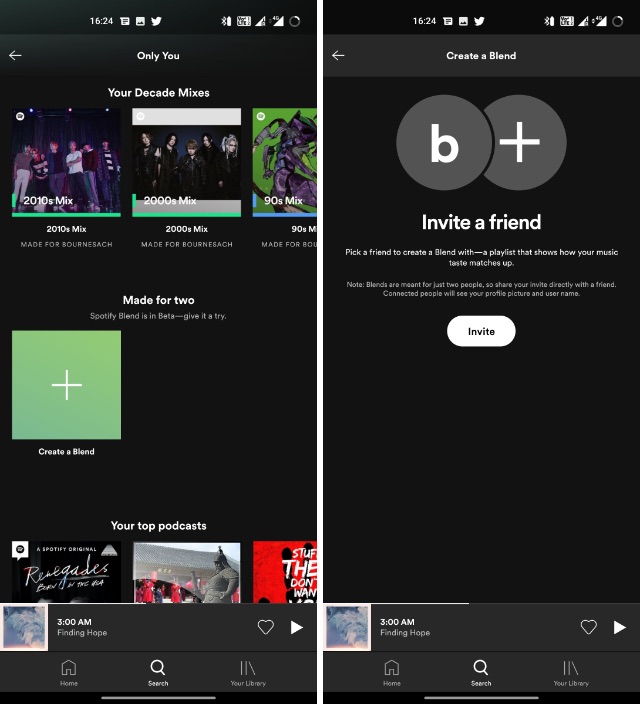
Find the location of `statue`. statue is located at coordinates (221, 584).